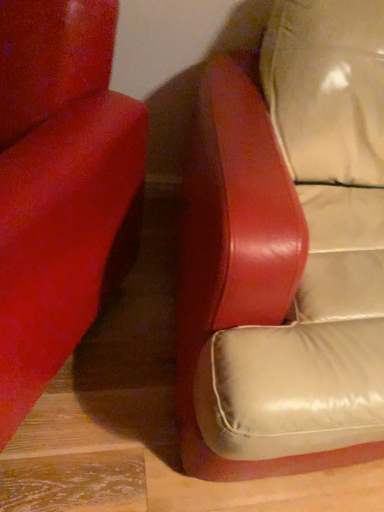
You are a GUI agent. You are given a task and a screenshot of the screen. Output one action in this format:
    pyautogui.click(x=<x>, y=<y>)
    Task: Click on the matte red chair at left
    This screenshot has height=512, width=384.
    Given the screenshot: What is the action you would take?
    pyautogui.click(x=61, y=188)

The width and height of the screenshot is (384, 512). Describe the element at coordinates (61, 188) in the screenshot. I see `matte red chair at left` at that location.

This screenshot has height=512, width=384. In order to click on matte red chair at left in this screenshot , I will do `click(61, 188)`.